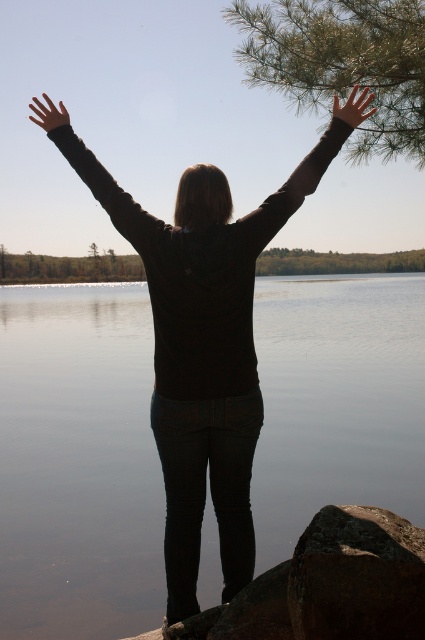
In the scene shown: You are a photographer positioned at the lake edge. You want to capture a photo where the rough textured rock at lower right and the matte black arm at upper center are both visible. Which object will appear larger in the photo?

The rough textured rock at lower right will appear larger in the photo because it is closer to the viewer than the matte black arm at upper center.

From the picture: You are a photographer trying to capture the scene. You notice the rough textured rock at lower right and the matte black arm at upper center. Which object is shorter in height?

The rough textured rock at lower right has a lesser height compared to the matte black arm at upper center, so the rough textured rock at lower right is shorter in height.